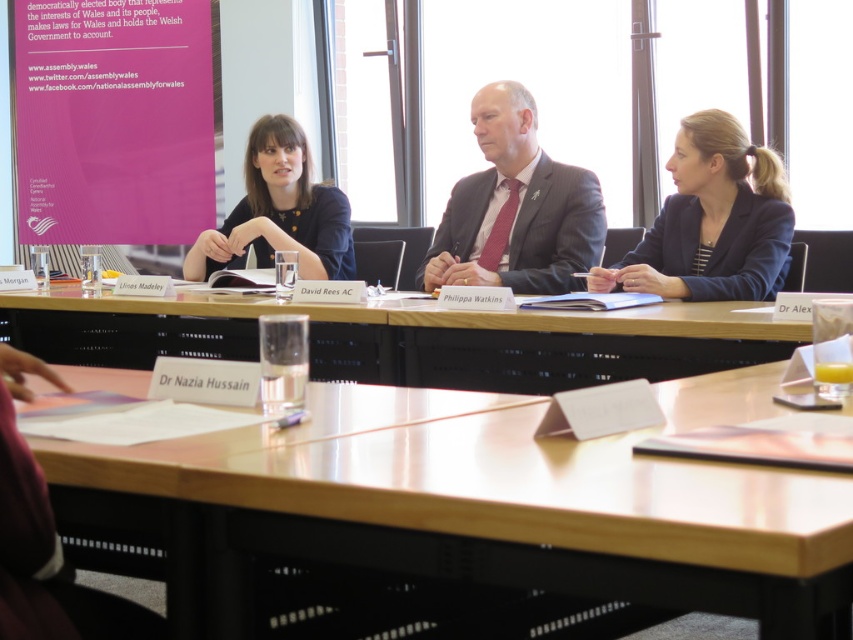
You are organizing a small group discussion and need to place two wooden tables in a room. The wooden table at lower left and the wooden table at center are available. Which table should you choose if you want the one that can accommodate more people?

The wooden table at center is larger in size compared to the wooden table at lower left, so it can accommodate more people.

You are attending a meeting in this room and need to place a document on the table between the two points labeled point (717, 326) and point (332, 237). Which point should the document be closer to if it needs to be placed closer to the front of the room?

The document should be placed closer to point (717, 326) because it is in front of point (332, 237), so positioning it near the front point ensures it is closer to the front of the room.